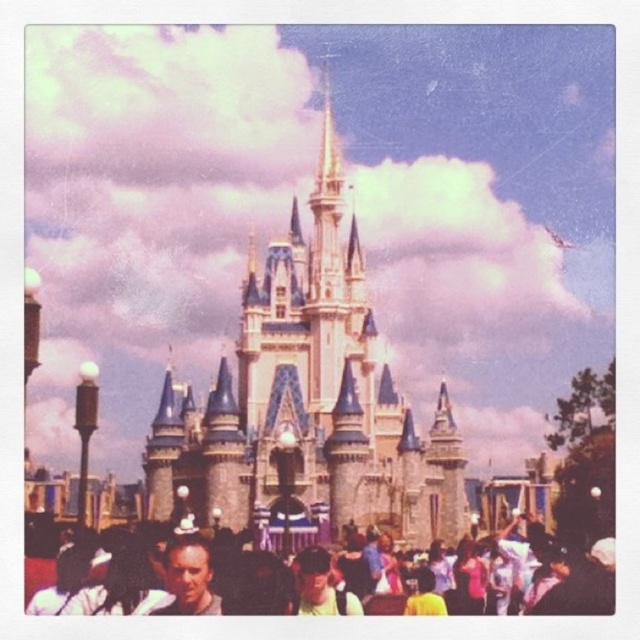
Which is above, multicolored fabric crowd at lower center or matte yellow shirt at center?

Positioned higher is multicolored fabric crowd at lower center.

Can you confirm if multicolored fabric crowd at lower center is thinner than matte yellow shirt at center?

No.

Identify the location of multicolored fabric crowd at lower center. The width and height of the screenshot is (640, 640). (323, 579).

In order to click on multicolored fabric crowd at lower center in this screenshot , I will do `click(323, 579)`.

Describe the element at coordinates (307, 404) in the screenshot. The width and height of the screenshot is (640, 640). I see `white stone castle at center` at that location.

Describe the element at coordinates (307, 404) in the screenshot. This screenshot has height=640, width=640. I see `white stone castle at center` at that location.

You are a GUI agent. You are given a task and a screenshot of the screen. Output one action in this format:
    pyautogui.click(x=<x>, y=<y>)
    Task: Click on the white stone castle at center
    This screenshot has height=640, width=640.
    Given the screenshot: What is the action you would take?
    pyautogui.click(x=307, y=404)

Between white stone castle at center and matte yellow shirt at center, which one has less height?

Standing shorter between the two is matte yellow shirt at center.

Find the location of `white stone castle at center`. white stone castle at center is located at coordinates (307, 404).

This screenshot has width=640, height=640. Describe the element at coordinates (307, 404) in the screenshot. I see `white stone castle at center` at that location.

The image size is (640, 640). What are the coordinates of `white stone castle at center` in the screenshot? It's located at (307, 404).